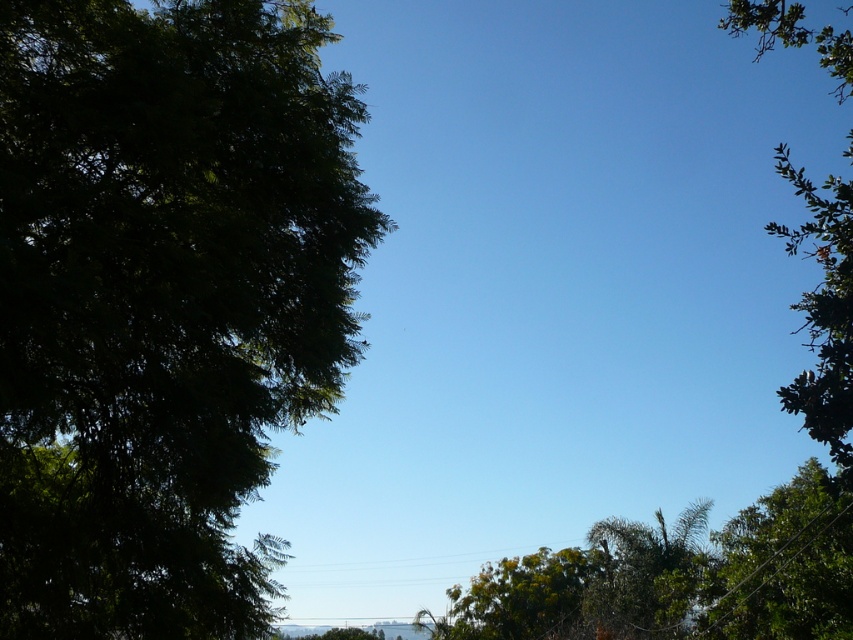
You are standing in the middle of the scene and see a point marked at coordinates (645, 573). Based on the scene description, can you determine which object this point belongs to?

The point at coordinates (645, 573) is on the green leafy tree at lower right.